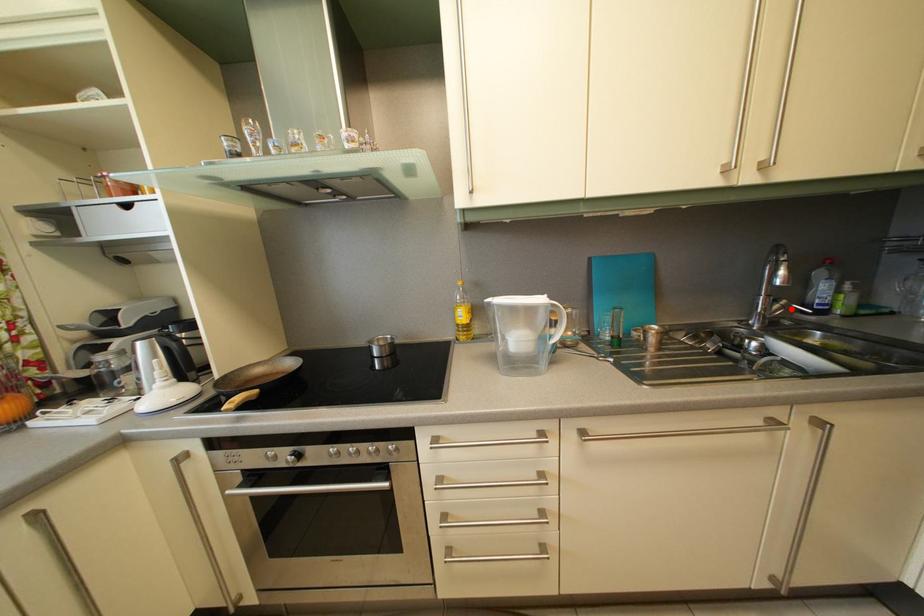
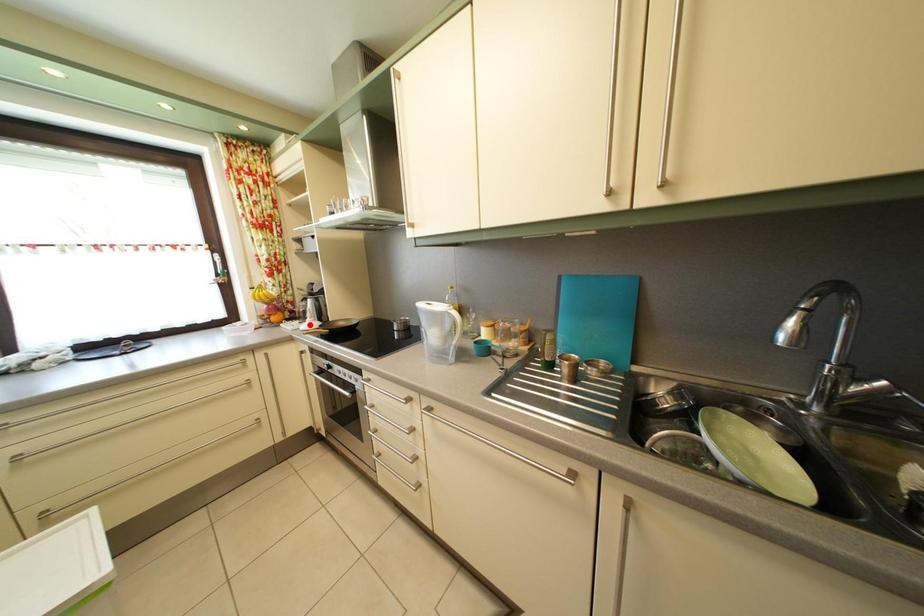
I am providing you with two images of the same scene from different viewpoints. A red point is marked on the first image and another point is marked on the second image. Are the points marked in image1 and image2 representing the same 3D position?

No